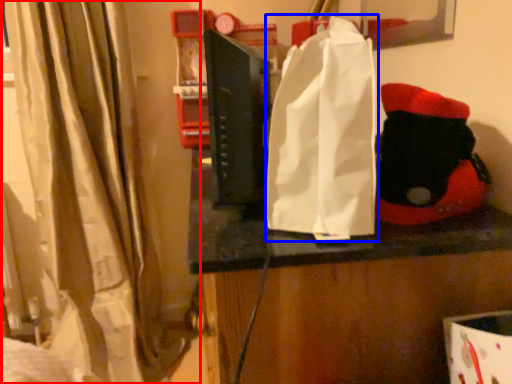
Question: Which object is closer to the camera taking this photo, curtain (highlighted by a red box) or grocery bag (highlighted by a blue box)?

Choices:
 (A) curtain
 (B) grocery bag

Answer: (B)